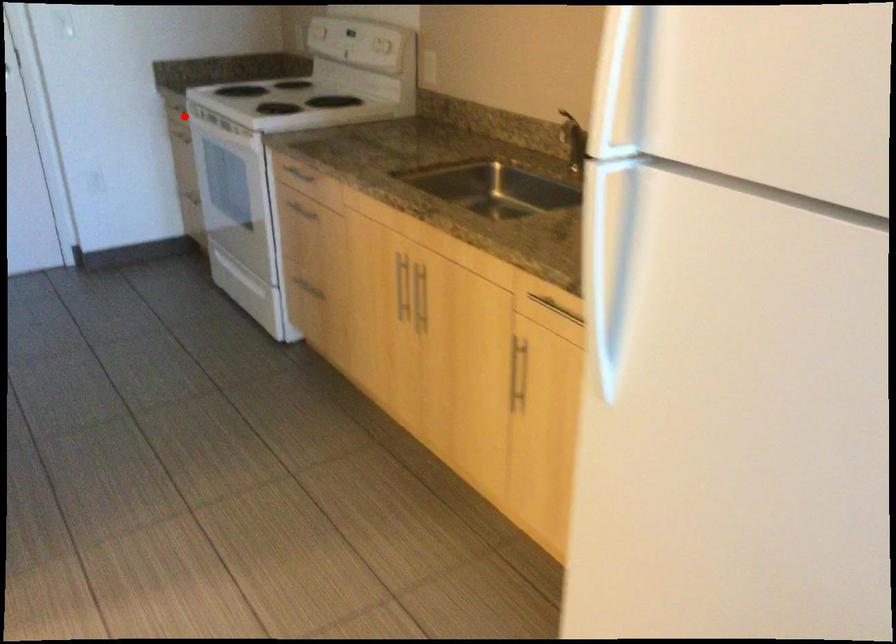
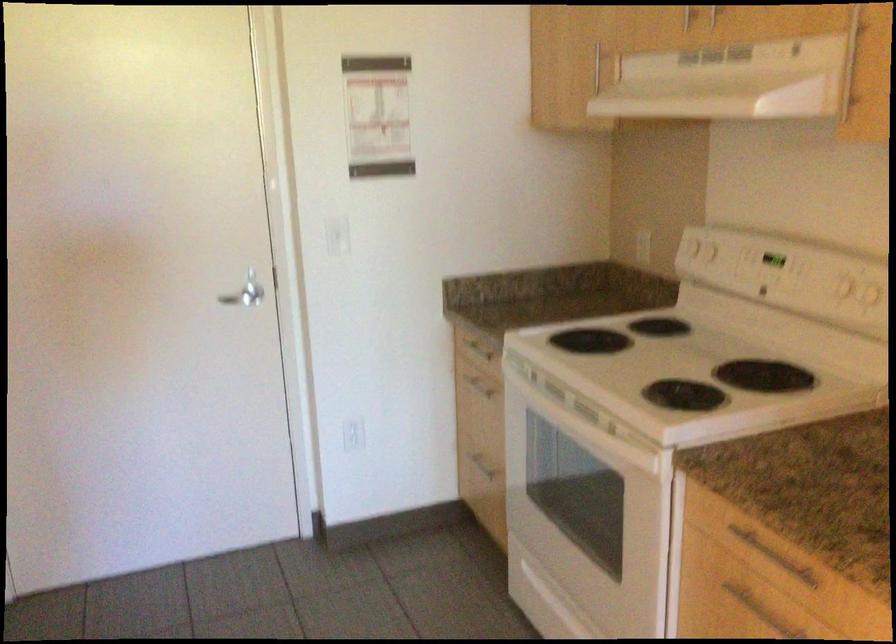
Question: I am providing you with two images of the same scene from different viewpoints. A red point is shown in image1. For the corresponding object point in image2, is it positioned nearer or farther from the camera?

Choices:
 (A) Nearer
 (B) Farther

Answer: (A)